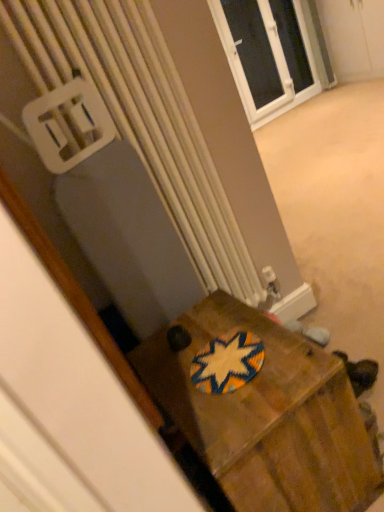
From the picture: Measure the distance between wooden box at center and camera.

wooden box at center and camera are 34.88 inches apart from each other.

What is the approximate height of woven fabric coaster at center?

It is 1.09 inches.

Measure the distance between woven fabric coaster at center and camera.

A distance of 1.04 meters exists between woven fabric coaster at center and camera.

Identify the location of white plastic radiator at center. (141, 116).

Is the position of white plastic window at upper center less distant than that of wooden box at center?

No, white plastic window at upper center is behind wooden box at center.

Locate an element on the screen. The height and width of the screenshot is (512, 384). window above the wooden box at center (from a real-world perspective) is located at coordinates (266, 55).

From the image's perspective, who appears lower, white plastic window at upper center or wooden box at center?

wooden box at center.

How distant is wooden box at center from woven fabric coaster at center?

The distance of wooden box at center from woven fabric coaster at center is 15.23 centimeters.

Consider the image. Which is more to the left, wooden box at center or woven fabric coaster at center?

woven fabric coaster at center is more to the left.

Is wooden box at center facing away from woven fabric coaster at center?

No, woven fabric coaster at center is not at the back of wooden box at center.

Is wooden box at center next to woven fabric coaster at center and touching it?

No, wooden box at center is not making contact with woven fabric coaster at center.

From the image's perspective, which one is positioned higher, white plastic radiator at center or wooden box at center?

From the image's view, white plastic radiator at center is above.

Does white plastic radiator at center appear on the left side of wooden box at center?

Indeed, white plastic radiator at center is positioned on the left side of wooden box at center.

Which is closer to the camera, (42, 75) or (302, 500)?

Point (42, 75) is farther from the camera than point (302, 500).

Who is bigger, white plastic radiator at center or wooden box at center?

Bigger between the two is wooden box at center.

From a real-world perspective, which object stands above the other?

white plastic radiator at center.

Based on the photo, from their relative heights in the image, would you say white plastic radiator at center is taller or shorter than woven fabric coaster at center?

Clearly, white plastic radiator at center is taller compared to woven fabric coaster at center.

What's the angular difference between white plastic radiator at center and woven fabric coaster at center's facing directions?

The angle between the facing direction of white plastic radiator at center and the facing direction of woven fabric coaster at center is 92.5 degrees.

From the image's perspective, which is above, white plastic radiator at center or woven fabric coaster at center?

white plastic radiator at center is shown above in the image.

Is wooden box at center looking in the opposite direction of white plastic radiator at center?

No, white plastic radiator at center is not at the back of wooden box at center.

Would you say wooden box at center is outside white plastic radiator at center?

Yes, wooden box at center is not within white plastic radiator at center.

Is white plastic window at upper center to the right of woven fabric coaster at center from the viewer's perspective?

Correct, you'll find white plastic window at upper center to the right of woven fabric coaster at center.

Is white plastic window at upper center not close to woven fabric coaster at center?

Yes, white plastic window at upper center and woven fabric coaster at center are located far from each other.

At what (x,y) coordinates should I click in order to perform the action: click on window behind the woven fabric coaster at center. Please return your answer as a coordinate pair (x, y). Looking at the image, I should click on (266, 55).

How different are the orientations of white plastic radiator at center and white plastic window at upper center in degrees?

white plastic radiator at center and white plastic window at upper center are facing 0.694 degrees away from each other.

From the image's perspective, is white plastic radiator at center on white plastic window at upper center?

No, from the image's perspective, white plastic radiator at center is not above white plastic window at upper center.

Is white plastic radiator at center smaller than white plastic window at upper center?

Correct, white plastic radiator at center occupies less space than white plastic window at upper center.

Is white plastic radiator at center not close to white plastic window at upper center?

Yes, white plastic radiator at center is far from white plastic window at upper center.

The image size is (384, 512). I want to click on furniture on the left side of white plastic window at upper center, so click(267, 416).

Locate an element on the screen. The image size is (384, 512). design above the wooden box at center (from a real-world perspective) is located at coordinates (227, 362).

Estimate the real-world distances between objects in this image. Which object is further from wooden box at center, white plastic window at upper center or woven fabric coaster at center?

Among the two, white plastic window at upper center is located further to wooden box at center.

Considering their positions, is white plastic window at upper center positioned further to wooden box at center than white plastic radiator at center?

white plastic window at upper center is further to wooden box at center.

Based on their spatial positions, is wooden box at center or white plastic window at upper center further from woven fabric coaster at center?

white plastic window at upper center lies further to woven fabric coaster at center than the other object.

Which object lies nearer to the anchor point white plastic radiator at center, white plastic window at upper center or woven fabric coaster at center?

Based on the image, woven fabric coaster at center appears to be nearer to white plastic radiator at center.

Considering their positions, is white plastic window at upper center positioned further to woven fabric coaster at center than wooden box at center?

white plastic window at upper center.

Considering their positions, is white plastic radiator at center positioned closer to woven fabric coaster at center than wooden box at center?

wooden box at center.

Considering their positions, is wooden box at center positioned further to woven fabric coaster at center than white plastic radiator at center?

Based on the image, white plastic radiator at center appears to be further to woven fabric coaster at center.

Based on their spatial positions, is white plastic radiator at center or woven fabric coaster at center closer to wooden box at center?

woven fabric coaster at center.

Identify the location of design positioned between wooden box at center and white plastic window at upper center from near to far. (227, 362).

At what (x,y) coordinates should I click in order to perform the action: click on radiator between woven fabric coaster at center and white plastic window at upper center from front to back. Please return your answer as a coordinate pair (x, y). Looking at the image, I should click on [141, 116].

Locate an element on the screen. This screenshot has height=512, width=384. radiator positioned between wooden box at center and white plastic window at upper center from near to far is located at coordinates (141, 116).

This screenshot has height=512, width=384. Find the location of `design between white plastic radiator at center and wooden box at center in the up-down direction`. design between white plastic radiator at center and wooden box at center in the up-down direction is located at coordinates (227, 362).